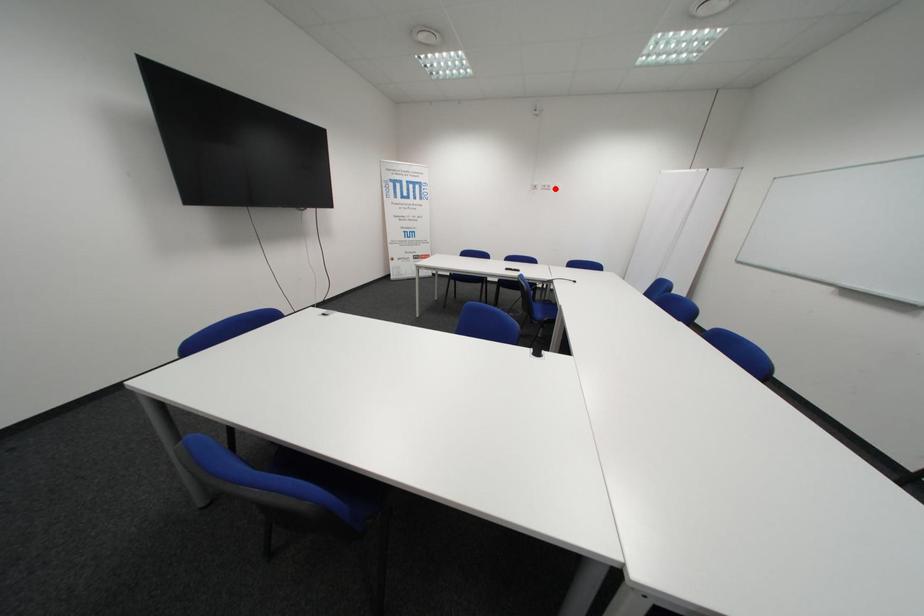
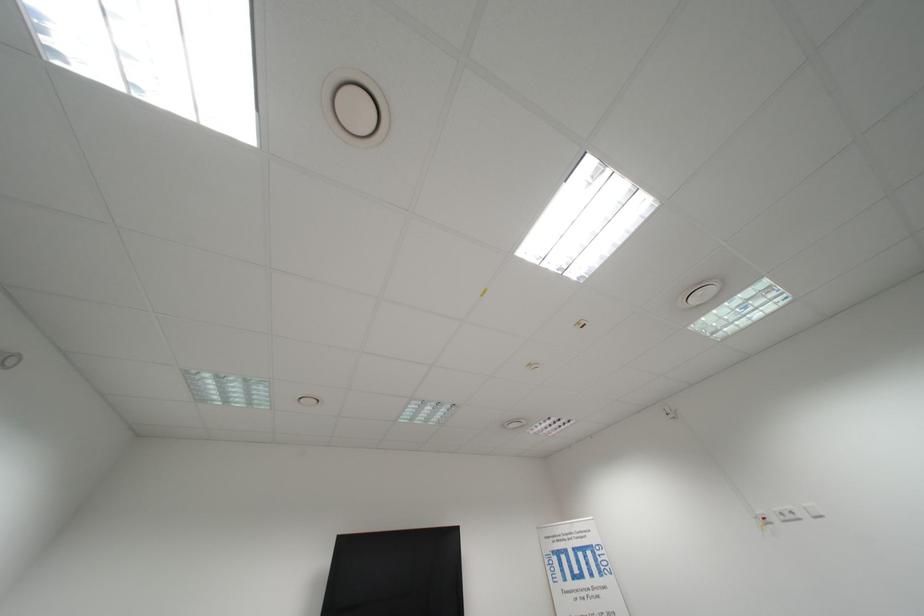
Question: I am providing you with two images of the same scene from different viewpoints. A red point is marked on the first image. At the location where the point appears in image 1, is it still visible in image 2?

Choices:
 (A) Yes
 (B) No

Answer: (A)